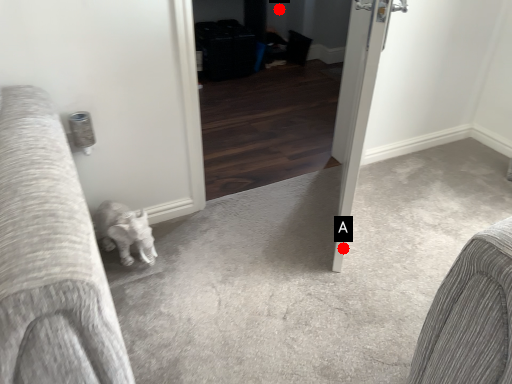
Question: Two points are circled on the image, labeled by A and B beside each circle. Which of the following is the closest to the observer?

Choices:
 (A) A is closer
 (B) B is closer

Answer: (A)